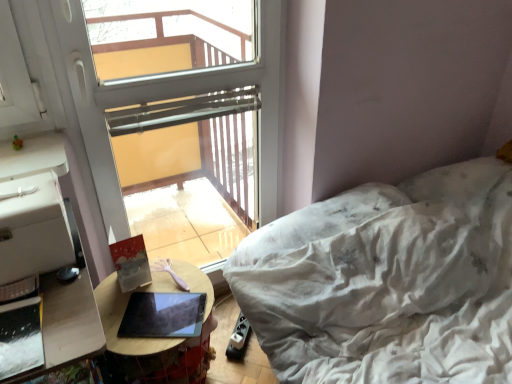
The height and width of the screenshot is (384, 512). Find the location of `free space to the left of matte black tablet at center`. free space to the left of matte black tablet at center is located at coordinates (113, 313).